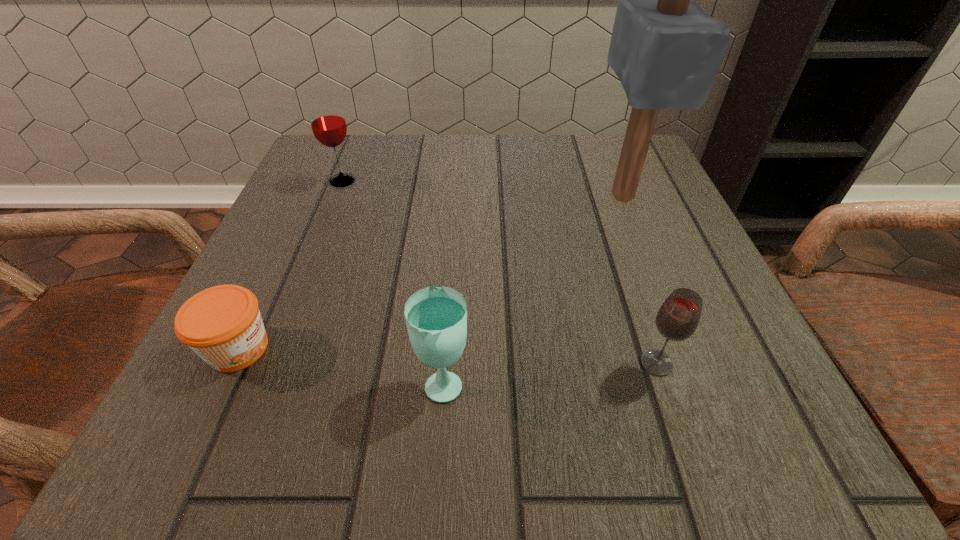
What are the coordinates of `vacant space at the near edge of the desktop` in the screenshot? It's located at (396, 412).

You are a GUI agent. You are given a task and a screenshot of the screen. Output one action in this format:
    pyautogui.click(x=<x>, y=<y>)
    Task: Click on the free region at the left edge
    The height and width of the screenshot is (540, 960).
    Given the screenshot: What is the action you would take?
    pyautogui.click(x=287, y=364)

Locate an element on the screen. Image resolution: width=960 pixels, height=540 pixels. free space at the right edge is located at coordinates (668, 352).

The height and width of the screenshot is (540, 960). What are the coordinates of `vacant space at the far left corner of the desktop` in the screenshot? It's located at (369, 184).

The height and width of the screenshot is (540, 960). Find the location of `vacant area at the near left corner`. vacant area at the near left corner is located at coordinates pos(285,394).

Find the location of a particular element. The height and width of the screenshot is (540, 960). vacant space at the near right corner of the desktop is located at coordinates (668, 401).

This screenshot has height=540, width=960. In order to click on empty space that is in between the mallet and the jam in this screenshot , I will do `click(430, 272)`.

Where is `unoccupied area between the tallest object and the farthest glass drink container`? This screenshot has height=540, width=960. unoccupied area between the tallest object and the farthest glass drink container is located at coordinates (482, 188).

You are a GUI agent. You are given a task and a screenshot of the screen. Output one action in this format:
    pyautogui.click(x=<x>, y=<y>)
    Task: Click on the free space between the shortest object and the mallet
    The width and height of the screenshot is (960, 540).
    Given the screenshot: What is the action you would take?
    pyautogui.click(x=430, y=272)

Image resolution: width=960 pixels, height=540 pixels. I want to click on vacant space in between the rightmost glass drink container and the tallest object, so click(x=639, y=279).